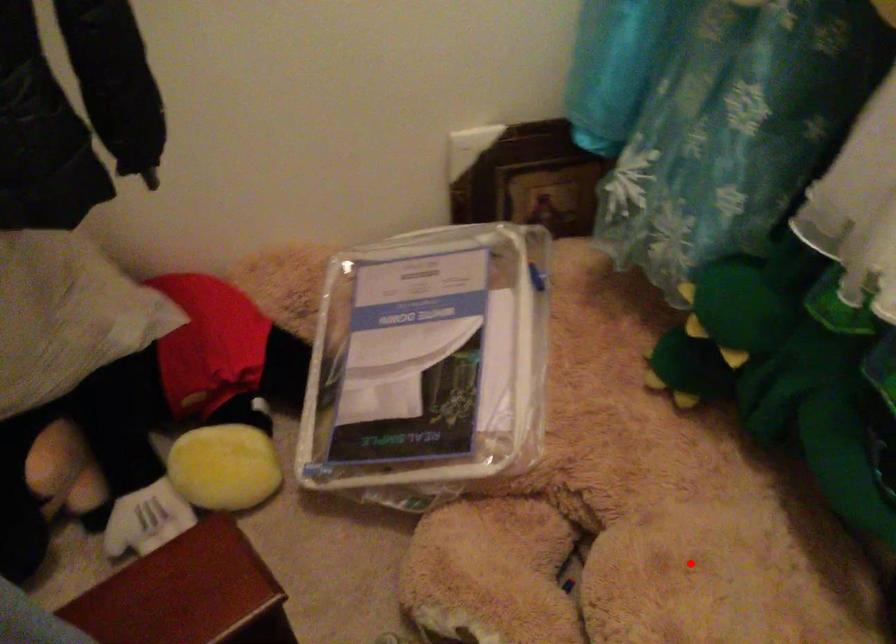
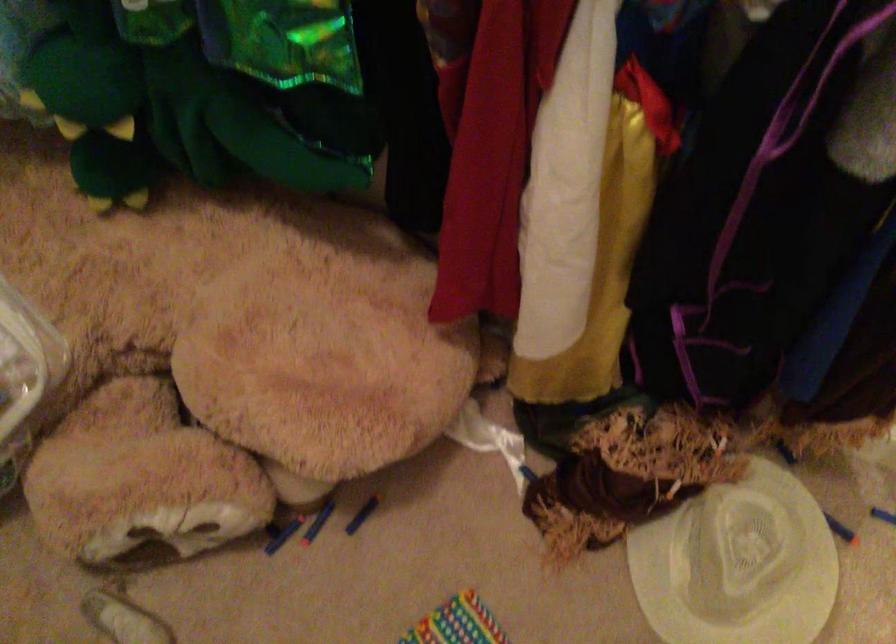
Locate, in the second image, the point that corresponds to the highlighted location in the first image.

(247, 321)